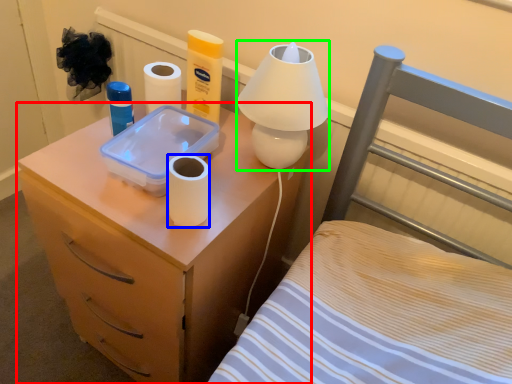
Question: Considering the real-world distances, which object is farthest from nightstand (highlighted by a red box)? toilet paper (highlighted by a blue box) or table lamp (highlighted by a green box)?

Choices:
 (A) toilet paper
 (B) table lamp

Answer: (B)